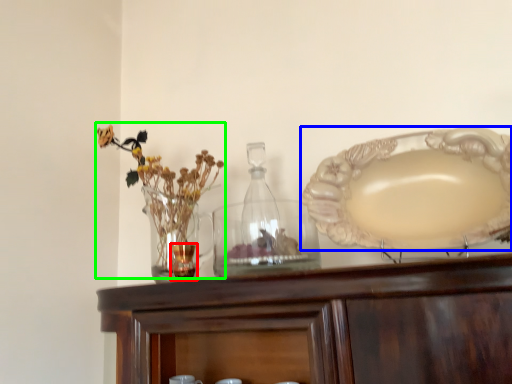
Question: Based on their relative distances, which object is farther from tableware (highlighted by a red box)? Choose from plate (highlighted by a blue box) and floral arrangement (highlighted by a green box).

Choices:
 (A) plate
 (B) floral arrangement

Answer: (A)